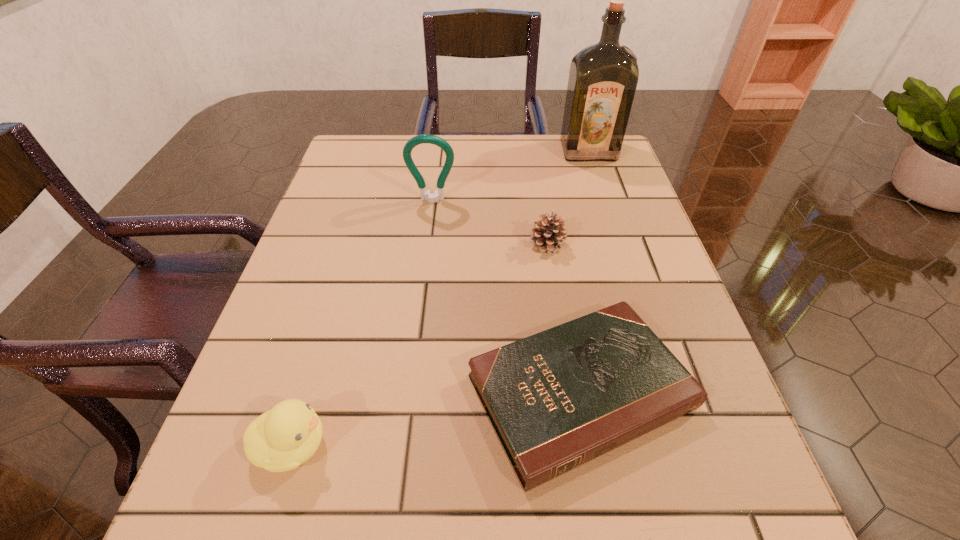
Where is `vacant area at the far edge`? The height and width of the screenshot is (540, 960). vacant area at the far edge is located at coordinates (511, 161).

The height and width of the screenshot is (540, 960). Find the location of `vacant space at the near edge of the desktop`. vacant space at the near edge of the desktop is located at coordinates (400, 526).

The height and width of the screenshot is (540, 960). Identify the location of free space at the left edge. (332, 325).

You are a GUI agent. You are given a task and a screenshot of the screen. Output one action in this format:
    pyautogui.click(x=<x>, y=<y>)
    Task: Click on the vacant space at the right edge of the desktop
    
    Given the screenshot: What is the action you would take?
    pyautogui.click(x=628, y=211)

In the image, there is a desktop. In order to click on free space at the far left corner in this screenshot , I will do `click(388, 167)`.

Where is `vacant space at the near left corner of the desktop`? The height and width of the screenshot is (540, 960). vacant space at the near left corner of the desktop is located at coordinates (208, 495).

The image size is (960, 540). Find the location of `free space between the third nearest object and the duckling`. free space between the third nearest object and the duckling is located at coordinates (420, 345).

Locate an element on the screen. The height and width of the screenshot is (540, 960). blank region between the shortest object and the fourth object from right to left is located at coordinates (506, 296).

What are the coordinates of `free point between the second tallest object and the shortest object` in the screenshot? It's located at (506, 296).

At what (x,y) coordinates should I click in order to perform the action: click on free space that is in between the Bible and the fourth shortest object. Please return your answer as a coordinate pair (x, y). Looking at the image, I should click on (506, 296).